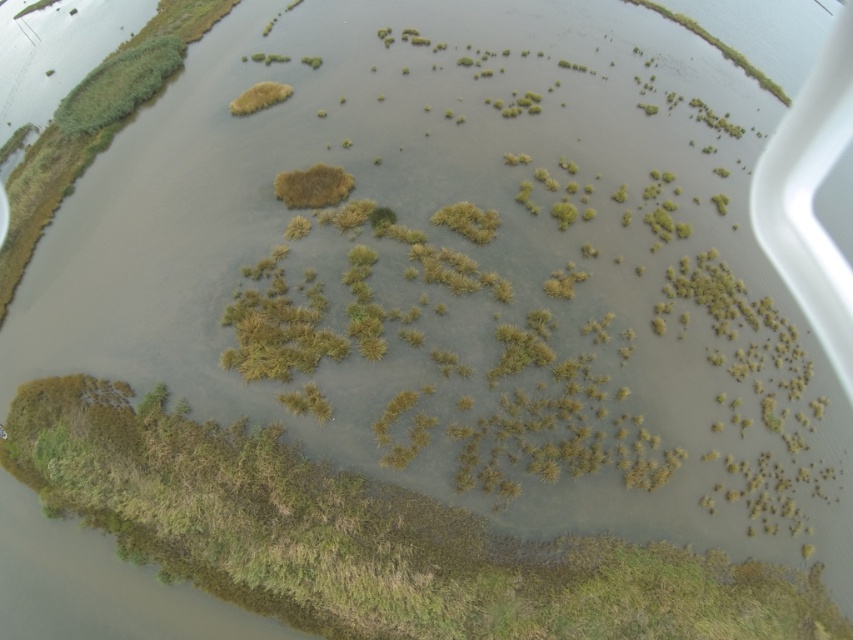
Question: Does green grass at upper center have a greater width compared to green fuzzy plant at upper center?

Choices:
 (A) no
 (B) yes

Answer: (B)

Question: From the image, what is the correct spatial relationship of green grass at upper center in relation to green fuzzy plant at upper center?

Choices:
 (A) right
 (B) left

Answer: (A)

Question: Can you confirm if green grass at upper center is positioned to the left of green fuzzy plant at upper center?

Choices:
 (A) no
 (B) yes

Answer: (A)